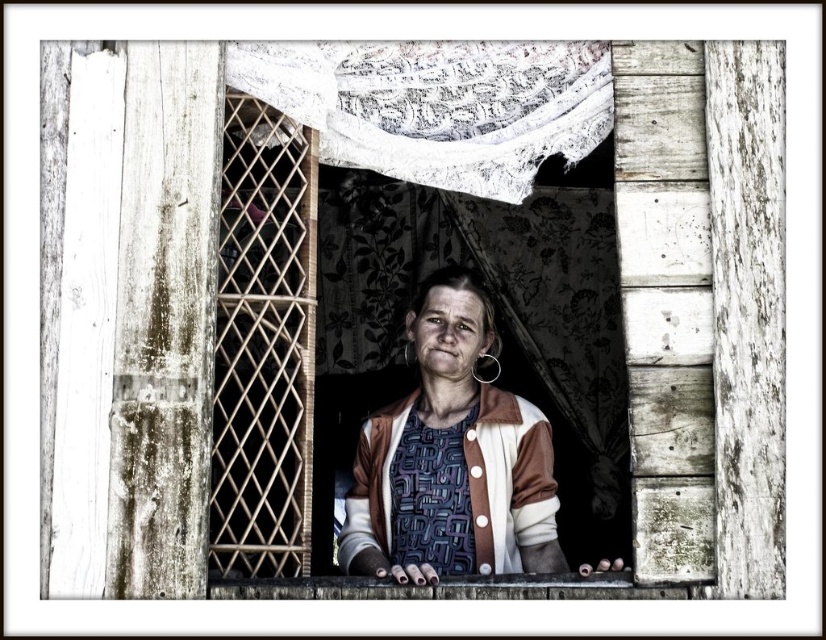
Is brown textured sweater at center wider than white lace curtain at upper center?

No.

Who is more forward, (453, 531) or (409, 84)?

Point (409, 84)

Does point (393, 554) come closer to viewer compared to point (350, 88)?

No, (393, 554) is behind (350, 88).

Locate an element on the screen. This screenshot has height=640, width=826. brown textured sweater at center is located at coordinates (452, 458).